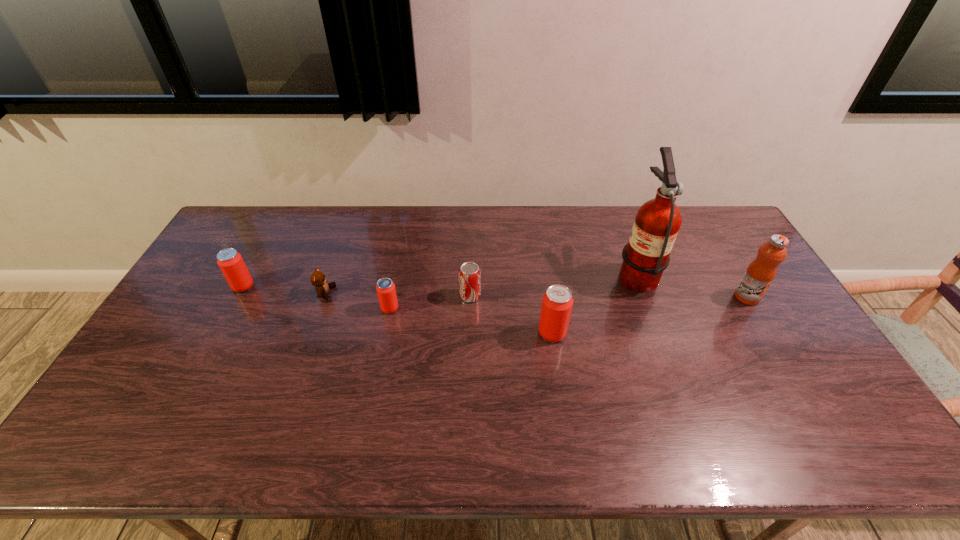
Where is `the farthest beer can`? The image size is (960, 540). the farthest beer can is located at coordinates (231, 263).

What are the coordinates of `the leftmost beer can` in the screenshot? It's located at (231, 263).

Where is `the fifth object from right to left`? The image size is (960, 540). the fifth object from right to left is located at coordinates (385, 288).

Identify the location of the second beer can from right to left. This screenshot has height=540, width=960. (385, 288).

The height and width of the screenshot is (540, 960). Find the location of `the rightmost beer can`. the rightmost beer can is located at coordinates (557, 302).

Identify the location of the third object from right to left. The width and height of the screenshot is (960, 540). (557, 302).

Identify the location of fire extinguisher. pyautogui.click(x=657, y=222).

I want to click on the sixth object from left to right, so click(657, 222).

Locate an element on the screen. The image size is (960, 540). the rightmost object is located at coordinates (760, 273).

Find the location of a particular element. The width and height of the screenshot is (960, 540). fruit juice is located at coordinates (760, 273).